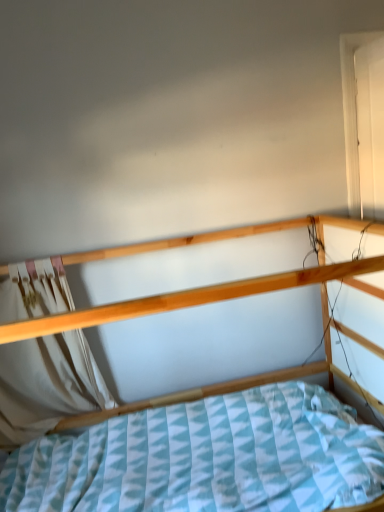
Question: From their relative heights in the image, would you say wooden bed at center is taller or shorter than white wood door at upper right?

Choices:
 (A) short
 (B) tall

Answer: (B)

Question: Considering the relative positions of wooden bed at center and white wood door at upper right in the image provided, is wooden bed at center to the left or to the right of white wood door at upper right?

Choices:
 (A) left
 (B) right

Answer: (A)

Question: Which is farther from the wooden bed at center?

Choices:
 (A) white fabric curtain at left
 (B) white wood door at upper right

Answer: (B)

Question: Which object is positioned closest to the white fabric curtain at left?

Choices:
 (A) wooden bed at center
 (B) white wood door at upper right

Answer: (A)